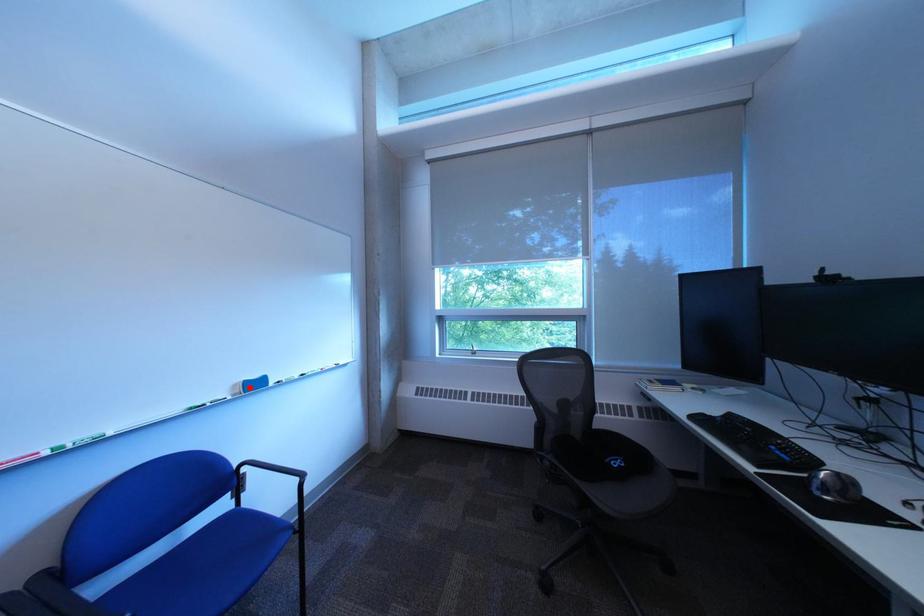
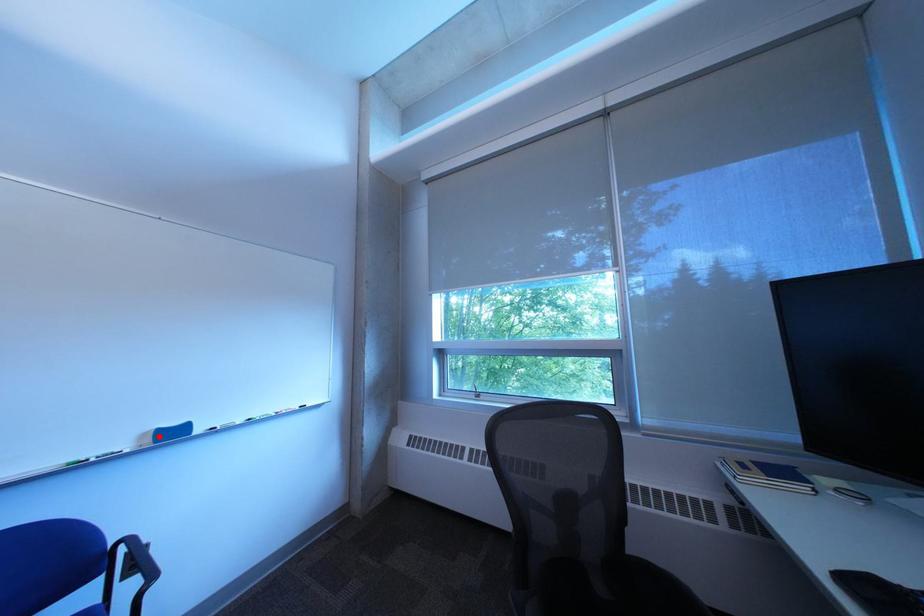
I am providing you with two images of the same scene from different viewpoints. A red point is marked on the first image and another point is marked on the second image. Does the point marked in image1 correspond to the same location as the one in image2?

Yes